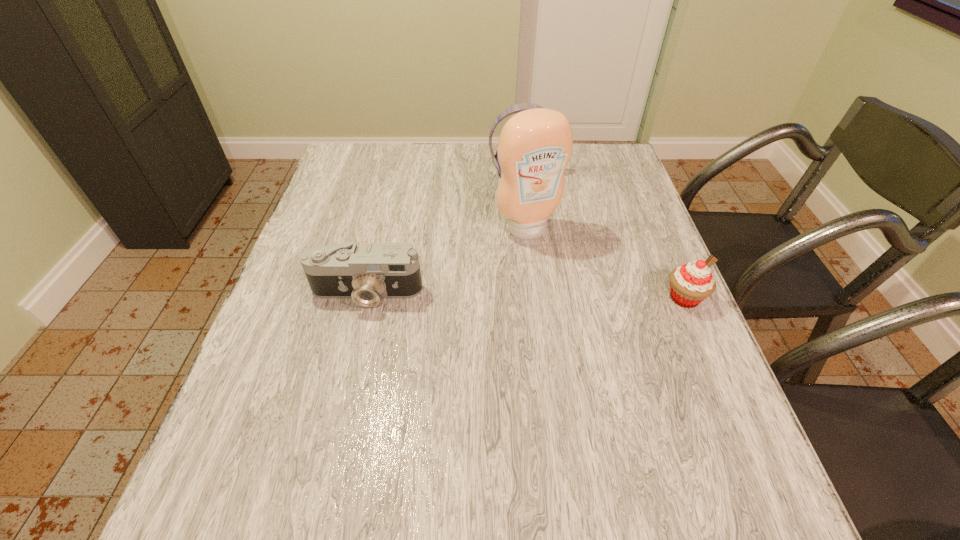
The height and width of the screenshot is (540, 960). I want to click on free spot on the desktop that is between the leftmost object and the cupcake and is positioned on the headband and ear cups of the headset, so click(x=561, y=296).

Locate an element on the screen. vacant space on the desktop that is between the camera and the cupcake and is positioned on the label of the tallest object is located at coordinates (567, 296).